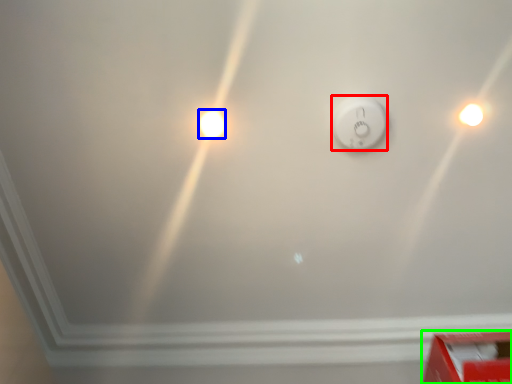
Question: Which object is the farthest from power plugs and sockets (highlighted by a red box)? Choose among these: light bulb (highlighted by a blue box) or box (highlighted by a green box).

Choices:
 (A) light bulb
 (B) box

Answer: (B)